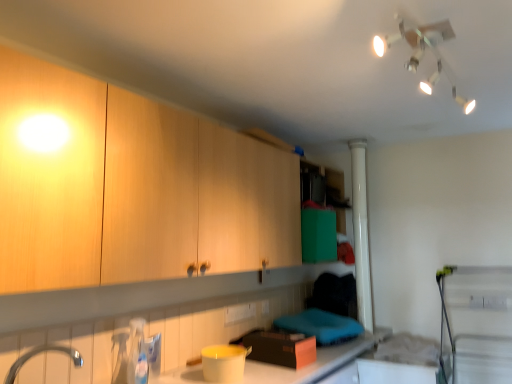
Question: Does matte plastic container at lower center lie in front of silver metallic tap at lower left?

Choices:
 (A) no
 (B) yes

Answer: (A)

Question: Is matte plastic container at lower center taller than silver metallic tap at lower left?

Choices:
 (A) yes
 (B) no

Answer: (A)

Question: From the image's perspective, is matte plastic container at lower center under silver metallic tap at lower left?

Choices:
 (A) yes
 (B) no

Answer: (A)

Question: From a real-world perspective, is matte plastic container at lower center under silver metallic tap at lower left?

Choices:
 (A) no
 (B) yes

Answer: (B)

Question: Does matte plastic container at lower center have a larger size compared to silver metallic tap at lower left?

Choices:
 (A) no
 (B) yes

Answer: (B)

Question: From a real-world perspective, is matte plastic container at lower center located higher than silver metallic tap at lower left?

Choices:
 (A) no
 (B) yes

Answer: (A)

Question: Is white plastic light fixture at upper center positioned before wooden cabinet at upper left?

Choices:
 (A) no
 (B) yes

Answer: (A)

Question: From a real-world perspective, is white plastic light fixture at upper center located higher than wooden cabinet at upper left?

Choices:
 (A) yes
 (B) no

Answer: (A)

Question: Is white plastic light fixture at upper center at the right side of wooden cabinet at upper left?

Choices:
 (A) yes
 (B) no

Answer: (A)

Question: Is white plastic light fixture at upper center not within wooden cabinet at upper left?

Choices:
 (A) yes
 (B) no

Answer: (A)

Question: Is white plastic light fixture at upper center facing towards wooden cabinet at upper left?

Choices:
 (A) no
 (B) yes

Answer: (A)

Question: Is white plastic light fixture at upper center shorter than wooden cabinet at upper left?

Choices:
 (A) yes
 (B) no

Answer: (A)

Question: Is silver metallic tap at lower left taller than matte plastic container at lower center?

Choices:
 (A) yes
 (B) no

Answer: (B)